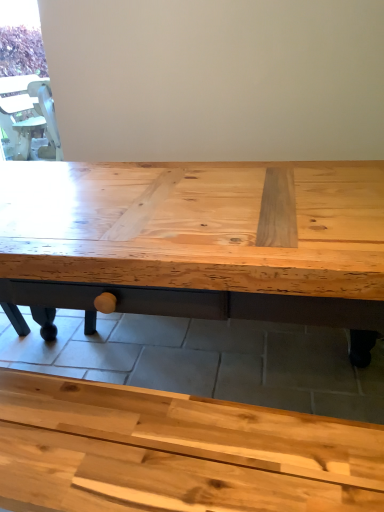
What do you see at coordinates (177, 452) in the screenshot? Image resolution: width=384 pixels, height=512 pixels. I see `natural wood table at center` at bounding box center [177, 452].

This screenshot has height=512, width=384. Identify the location of natural wood table at center. (177, 452).

Locate an element on the screen. natural wood table at center is located at coordinates (177, 452).